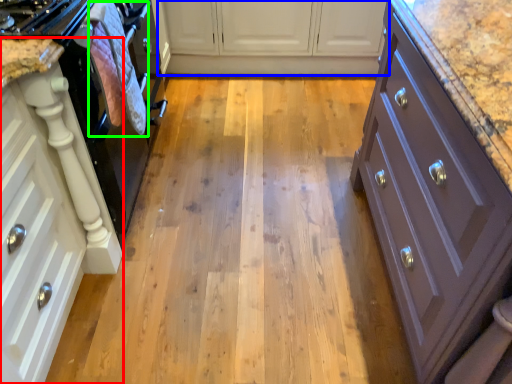
Question: Which object is the farthest from cabinetry (highlighted by a red box)? Choose among these: cabinetry (highlighted by a blue box) or material (highlighted by a green box).

Choices:
 (A) cabinetry
 (B) material

Answer: (A)